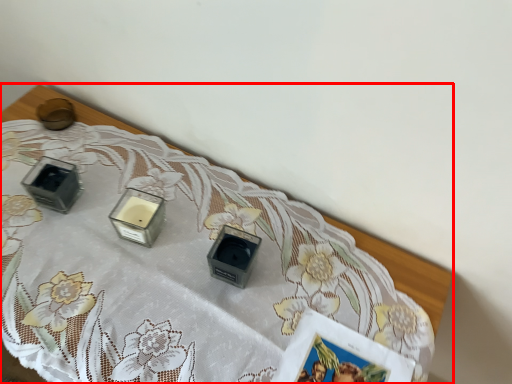
Question: From the image's perspective, considering the relative positions of table (annotated by the red box) and candle holder in the image provided, where is table (annotated by the red box) located with respect to the staircase?

Choices:
 (A) below
 (B) above

Answer: (A)